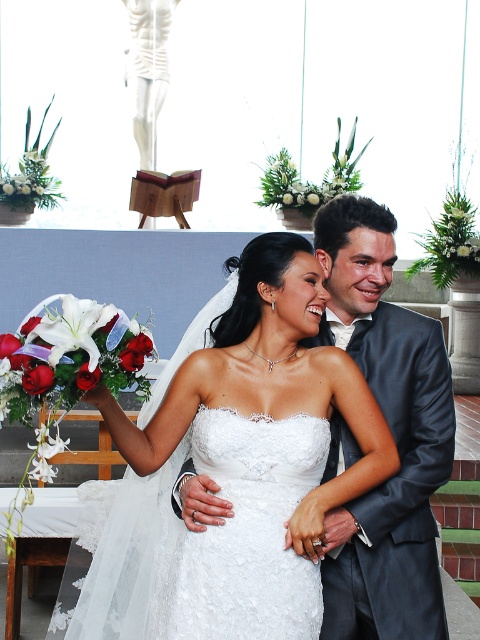
You are a photographer at the wedding and need to frame the bride in the center. The camera you are using has a maximum width capacity of 1.2 meters. Can you fit the white lace dress at center and the white lace wedding dress at center into the frame without cropping either of them?

The white lace dress at center is wider than the white lace wedding dress at center. Since the camera has a maximum width capacity of 1.2 meters, it depends on the combined width of both dresses. However, the description only provides a comparison between their widths, not their exact measurements. Without knowing the exact width of either dress, it is impossible to determine if they can fit within the camera frame.

You are a photographer standing at the back of the church and want to take a photo of both the white lace dress at center and the white lace wedding dress at center. Which one will appear closer to you in the photo?

The white lace dress at center will appear closer to you in the photo because it is positioned further to the viewer compared to the white lace wedding dress at center.

You are a photographer standing at the entrance of the church. You want to take a photo of the white lace dress at center. Where should you position yourself to capture the dress in the frame?

The white lace dress at center is positioned at coordinates point (236, 467), so you should aim your camera towards that point to ensure the dress is centered in the frame.